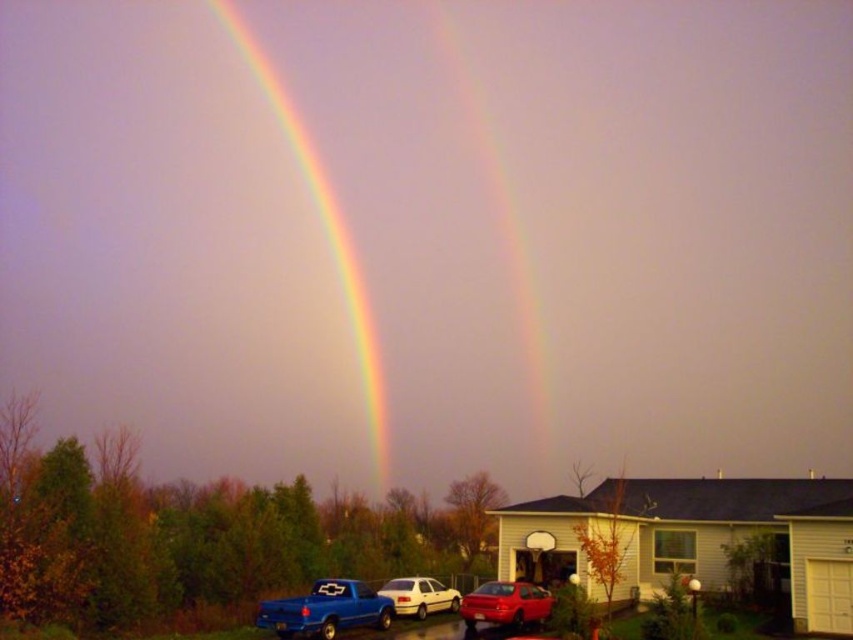
Question: Based on their relative distances, which object is nearer to the metallic blue truck at lower left?

Choices:
 (A) rainbow at upper left
 (B) matte blue truck at lower left
 (C) white matte sedan at center
 (D) shiny red sedan at center

Answer: (C)

Question: Can you confirm if rainbow at upper left is positioned above matte blue truck at lower left?

Choices:
 (A) yes
 (B) no

Answer: (A)

Question: Can you confirm if matte blue truck at lower left is positioned to the left of shiny red sedan at center?

Choices:
 (A) no
 (B) yes

Answer: (B)

Question: Estimate the real-world distances between objects in this image. Which object is closer to the matte blue truck at lower left?

Choices:
 (A) shiny red sedan at center
 (B) metallic blue truck at lower left
 (C) white matte sedan at center

Answer: (C)

Question: Can you confirm if shiny red sedan at center is bigger than white matte sedan at center?

Choices:
 (A) yes
 (B) no

Answer: (B)

Question: Which of the following is the farthest from the observer?

Choices:
 (A) (450, 589)
 (B) (175, 582)

Answer: (A)